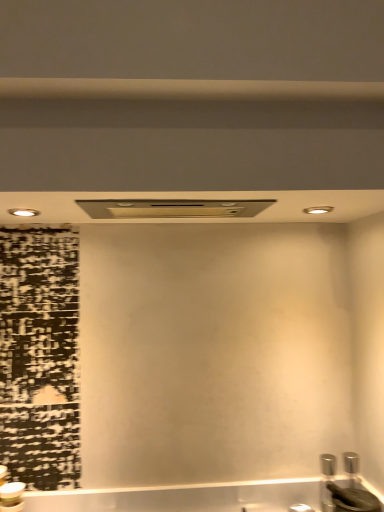
Question: Could you tell me if satin nickel exhaust hood at center is turned towards beige matte beam at upper center?

Choices:
 (A) no
 (B) yes

Answer: (A)

Question: From the image's perspective, is satin nickel exhaust hood at center on beige matte beam at upper center?

Choices:
 (A) yes
 (B) no

Answer: (B)

Question: Are satin nickel exhaust hood at center and beige matte beam at upper center located far from each other?

Choices:
 (A) no
 (B) yes

Answer: (A)

Question: Is satin nickel exhaust hood at center oriented away from beige matte beam at upper center?

Choices:
 (A) no
 (B) yes

Answer: (A)

Question: Considering the relative sizes of satin nickel exhaust hood at center and beige matte beam at upper center in the image provided, is satin nickel exhaust hood at center taller than beige matte beam at upper center?

Choices:
 (A) yes
 (B) no

Answer: (A)

Question: Is beige matte beam at upper center bigger or smaller than black matte sink at lower right?

Choices:
 (A) small
 (B) big

Answer: (B)

Question: Based on their positions, is beige matte beam at upper center located to the left or right of black matte sink at lower right?

Choices:
 (A) left
 (B) right

Answer: (A)

Question: Considering their positions, is beige matte beam at upper center located in front of or behind black matte sink at lower right?

Choices:
 (A) front
 (B) behind

Answer: (A)

Question: From the image's perspective, is beige matte beam at upper center above or below black matte sink at lower right?

Choices:
 (A) below
 (B) above

Answer: (B)

Question: Considering the positions of black matte sink at lower right and beige matte beam at upper center in the image, is black matte sink at lower right taller or shorter than beige matte beam at upper center?

Choices:
 (A) short
 (B) tall

Answer: (B)

Question: Relative to beige matte beam at upper center, is black matte sink at lower right in front or behind?

Choices:
 (A) behind
 (B) front

Answer: (A)

Question: From the image's perspective, is black matte sink at lower right located above or below beige matte beam at upper center?

Choices:
 (A) below
 (B) above

Answer: (A)

Question: Is black matte sink at lower right wider or thinner than beige matte beam at upper center?

Choices:
 (A) wide
 (B) thin

Answer: (B)

Question: Is satin nickel exhaust hood at center wider or thinner than black matte sink at lower right?

Choices:
 (A) thin
 (B) wide

Answer: (B)

Question: From a real-world perspective, is satin nickel exhaust hood at center above or below black matte sink at lower right?

Choices:
 (A) above
 (B) below

Answer: (A)